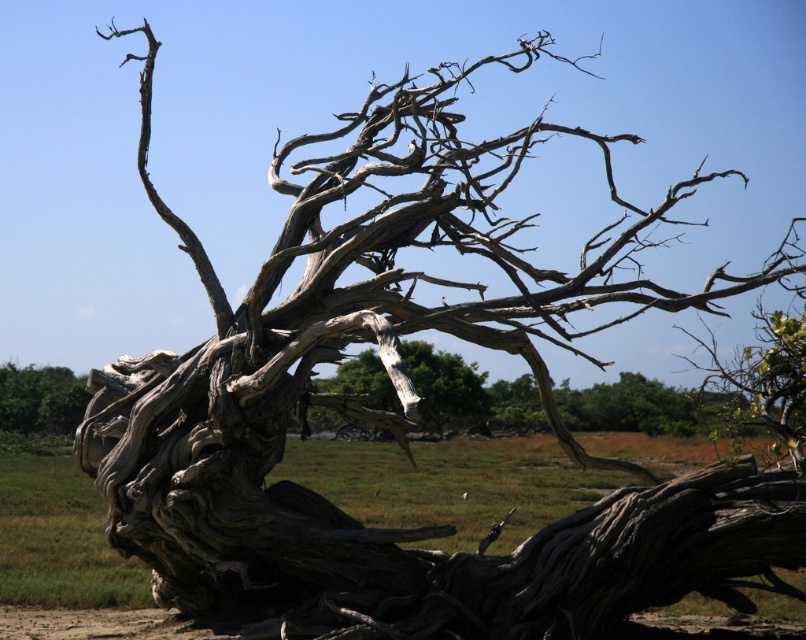
How much distance is there between gray textured driftwood at center and gray rough bark tree at center?

gray textured driftwood at center is 6.93 meters away from gray rough bark tree at center.

The height and width of the screenshot is (640, 806). What do you see at coordinates (642, 406) in the screenshot? I see `gray textured driftwood at center` at bounding box center [642, 406].

Identify the location of gray textured driftwood at center. (642, 406).

At what (x,y) coordinates should I click in order to perform the action: click on gray textured driftwood at center. Please return your answer as a coordinate pair (x, y). The height and width of the screenshot is (640, 806). Looking at the image, I should click on (642, 406).

Between gray rough bark tree at center and gray rough bark tree at lower left, which one is positioned higher?

gray rough bark tree at center is above.

Which is in front, point (438, 428) or point (19, 403)?

Point (438, 428) is in front.

Identify the location of gray rough bark tree at center. The width and height of the screenshot is (806, 640). (443, 387).

Is gray textured driftwood at center thinner than gray rough bark tree at lower left?

Correct, gray textured driftwood at center's width is less than gray rough bark tree at lower left's.

Between gray textured driftwood at center and gray rough bark tree at lower left, which one is positioned higher?

gray textured driftwood at center is above.

Where is `gray textured driftwood at center`? The image size is (806, 640). gray textured driftwood at center is located at coordinates (642, 406).